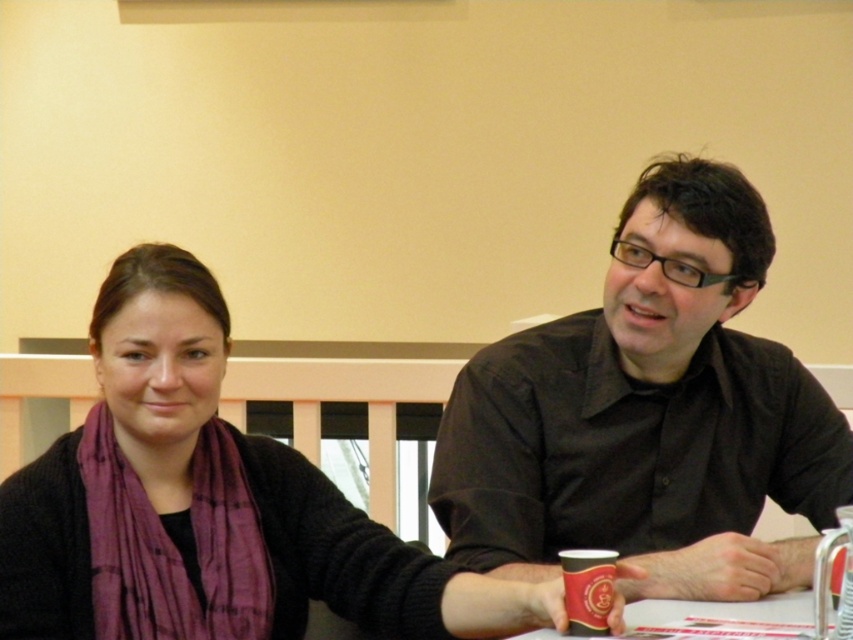
In the scene shown: You are a photographer trying to capture a clear shot of the purple scarf at center and the black matte cup at lower center. Since you want both items to be visible in the frame, which object should you focus on first to ensure proper depth of field?

The purple scarf at center is much taller than the black matte cup at lower center, so focusing on the purple scarf at center first will ensure the depth of field captures both objects clearly.